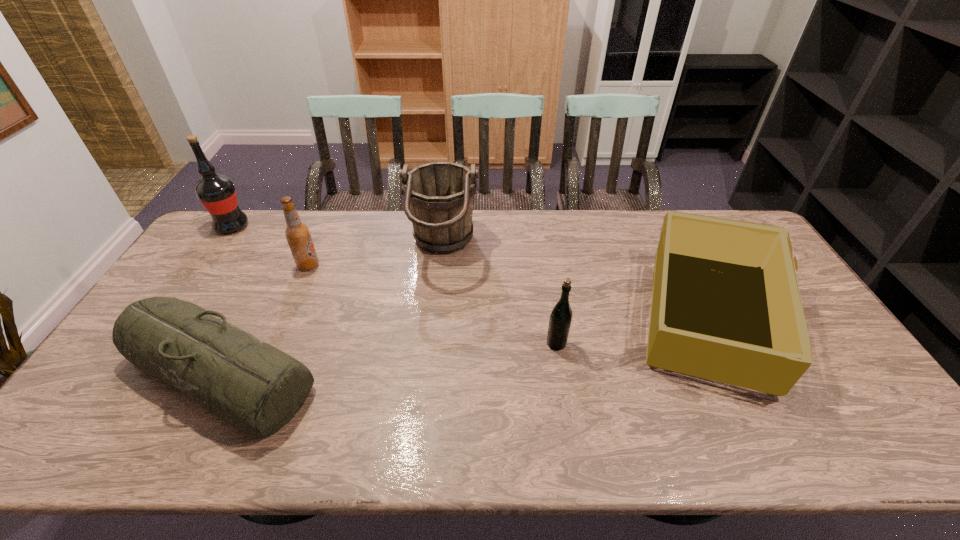
Identify the location of vacant region that satisfies the following two spatial constraints: 1. on the handle side of the second shortest object; 2. on the left side of the fourth object from left to right. (436, 319).

The width and height of the screenshot is (960, 540). Identify the location of vacant area that satisfies the following two spatial constraints: 1. on the front label of the farther beer bottle; 2. on the right side of the rightmost object. (285, 319).

Where is `free location that satisfies the following two spatial constraints: 1. on the back side of the nearer beer bottle; 2. on the handle side of the bucket`? free location that satisfies the following two spatial constraints: 1. on the back side of the nearer beer bottle; 2. on the handle side of the bucket is located at coordinates (541, 248).